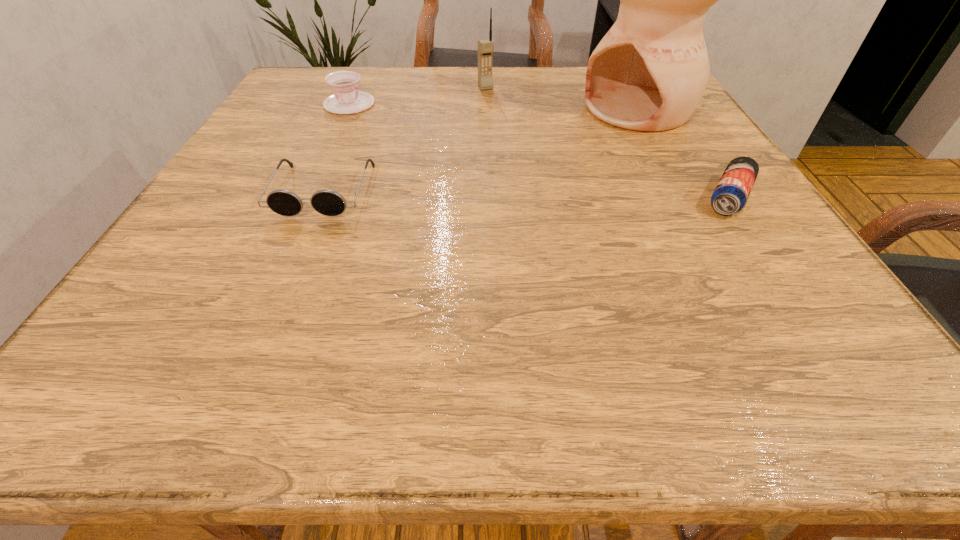
The image size is (960, 540). What are the coordinates of `vacant space at the far left corner` in the screenshot? It's located at (283, 88).

At what (x,y) coordinates should I click in order to perform the action: click on vacant space at the near right corner of the desktop. Please return your answer as a coordinate pair (x, y). The width and height of the screenshot is (960, 540). Looking at the image, I should click on (808, 286).

Locate an element on the screen. The image size is (960, 540). vacant space in between the pottery and the third object from right to left is located at coordinates (562, 98).

The width and height of the screenshot is (960, 540). I want to click on free spot between the pottery and the teacup, so click(x=493, y=106).

The width and height of the screenshot is (960, 540). What are the coordinates of `free area in between the third object from left to right and the beer can` in the screenshot? It's located at (608, 143).

You are a GUI agent. You are given a task and a screenshot of the screen. Output one action in this format:
    pyautogui.click(x=<x>, y=<y>)
    Task: Click on the free point between the beer can and the cellular telephone
    This screenshot has height=540, width=960.
    Given the screenshot: What is the action you would take?
    pyautogui.click(x=608, y=143)

Find the location of a particular element. This screenshot has width=960, height=540. vacant area that lies between the pottery and the sunglasses is located at coordinates (481, 150).

Locate an element on the screen. Image resolution: width=960 pixels, height=540 pixels. free space between the beer can and the fourth shortest object is located at coordinates (608, 143).

Find the location of `blank region between the beer can and the sunglasses`. blank region between the beer can and the sunglasses is located at coordinates (526, 194).

This screenshot has height=540, width=960. I want to click on vacant space in between the beer can and the tallest object, so click(x=684, y=153).